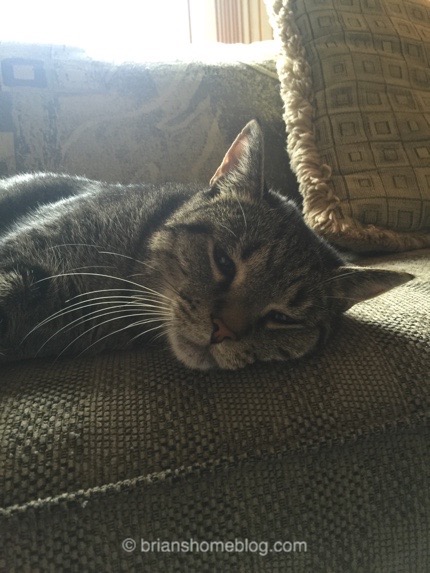
Where is `cat laying on sofa`? cat laying on sofa is located at coordinates (122, 235).